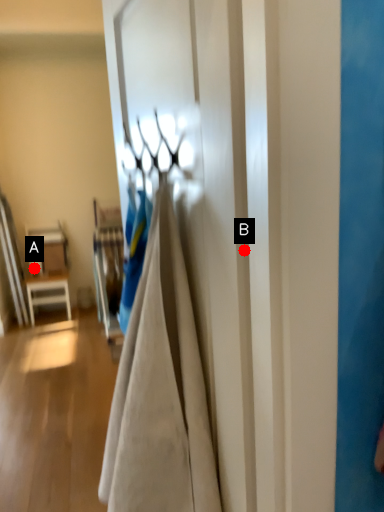
Question: Two points are circled on the image, labeled by A and B beside each circle. Which point appears farthest from the camera in this image?

Choices:
 (A) A is further
 (B) B is further

Answer: (A)